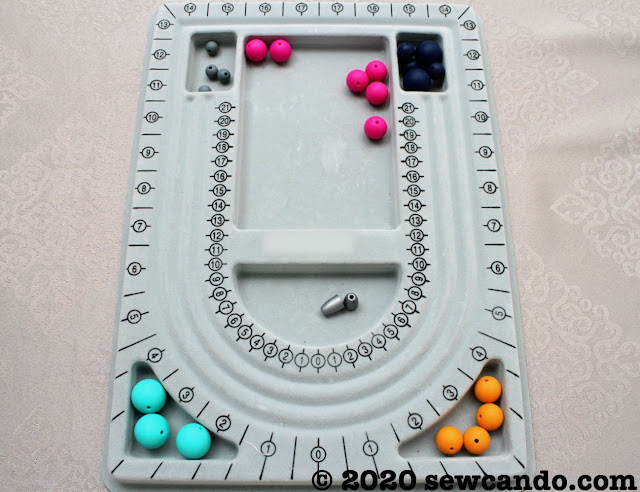
The width and height of the screenshot is (640, 492). Find the location of `tiny cylinder shaped silver gray bead`. tiny cylinder shaped silver gray bead is located at coordinates (332, 305).